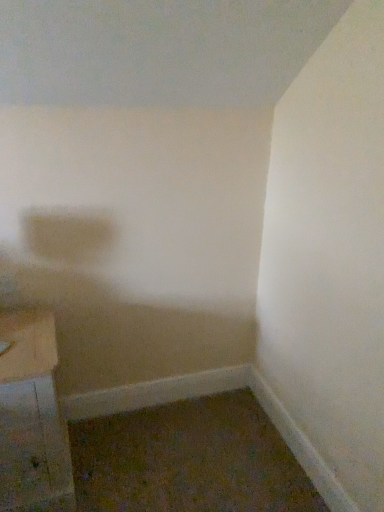
What do you see at coordinates (32, 418) in the screenshot? I see `wooden file cabinet at lower left` at bounding box center [32, 418].

You are a GUI agent. You are given a task and a screenshot of the screen. Output one action in this format:
    pyautogui.click(x=<x>, y=<y>)
    Task: Click on the wooden file cabinet at lower left
    Image resolution: width=384 pixels, height=512 pixels.
    Given the screenshot: What is the action you would take?
    pyautogui.click(x=32, y=418)

You are a GUI agent. You are given a task and a screenshot of the screen. Output one action in this format:
    pyautogui.click(x=<x>, y=<y>)
    Task: Click on the wooden file cabinet at lower left
    
    Given the screenshot: What is the action you would take?
    pyautogui.click(x=32, y=418)